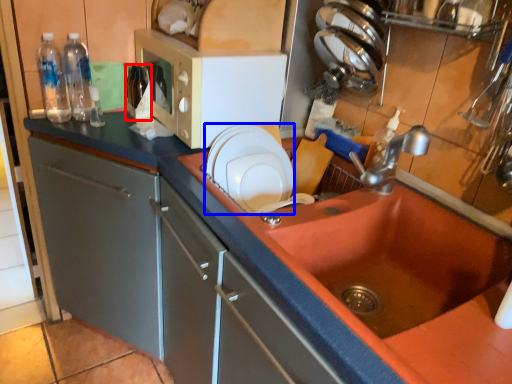
Question: Which object appears farthest to the camera in this image, bottle (highlighted by a red box) or appliance (highlighted by a blue box)?

Choices:
 (A) bottle
 (B) appliance

Answer: (A)